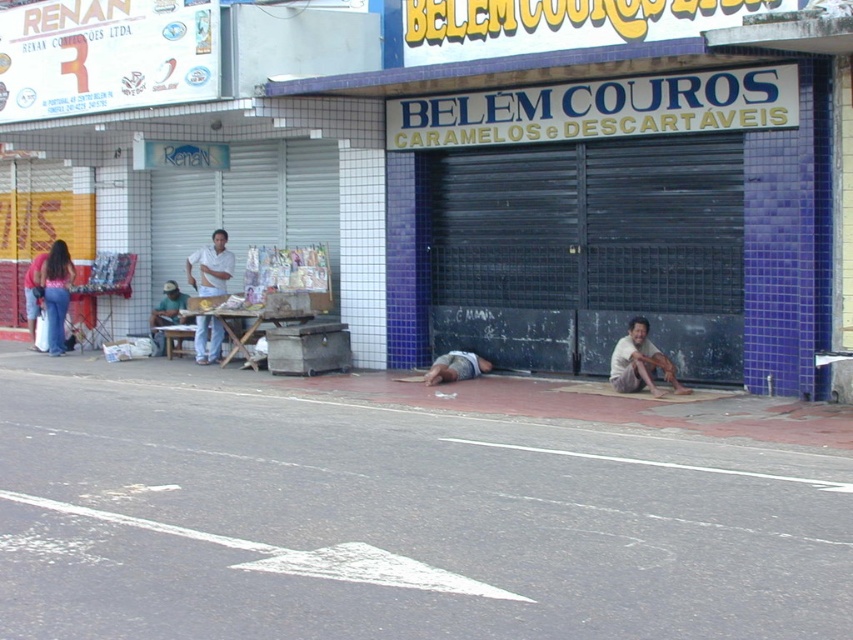
You are standing in front of the building with the sign BELEM COUROS CARAMELOS e DESCARTAVEIS. There are two points marked on the ground in front of you. One is at coordinate point (602, 109) and the other is at point (225, 236). Which point is closer to you?

The point at coordinate (602, 109) is closer to the viewer than point (225, 236).